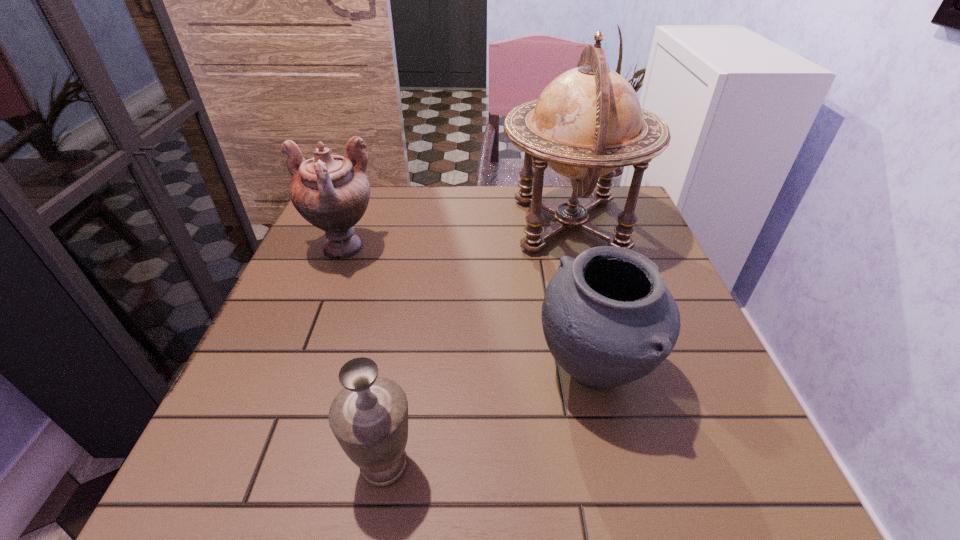
This screenshot has width=960, height=540. Find the location of `free space located 0.230m on the right of the leftmost object`. free space located 0.230m on the right of the leftmost object is located at coordinates (475, 248).

Identify the location of free location located 0.180m on the left of the second nearest urn. (434, 372).

At what (x,y) coordinates should I click in order to perform the action: click on vacant space located on the right of the nearest object. Please return your answer as a coordinate pair (x, y). Looking at the image, I should click on (665, 464).

Where is `globe present at the far edge`? The image size is (960, 540). globe present at the far edge is located at coordinates (588, 121).

The image size is (960, 540). Identify the location of urn situated at the far edge. (332, 192).

This screenshot has width=960, height=540. Identify the location of object present at the near edge. (369, 417).

The height and width of the screenshot is (540, 960). In order to click on object located in the left edge section of the desktop in this screenshot , I will do `click(332, 192)`.

Identify the location of globe that is at the right edge. (588, 121).

The width and height of the screenshot is (960, 540). Find the location of `urn at the right edge`. urn at the right edge is located at coordinates (608, 318).

You are a GUI agent. You are given a task and a screenshot of the screen. Output one action in this format:
    pyautogui.click(x=<x>, y=<y>)
    Task: Click on the object at the far left corner
    The image size is (960, 540).
    Given the screenshot: What is the action you would take?
    pyautogui.click(x=332, y=192)